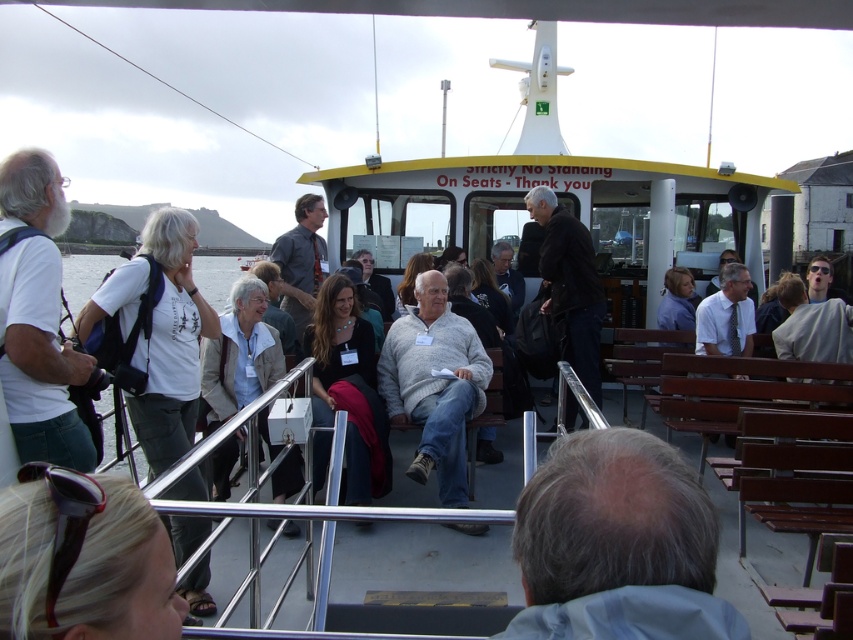
You are a GUI agent. You are given a task and a screenshot of the screen. Output one action in this format:
    pyautogui.click(x=<x>, y=<y>)
    Task: Click on the dark brown leather jacket at center
    This screenshot has width=853, height=640.
    Given the screenshot: What is the action you would take?
    pyautogui.click(x=570, y=285)

Which of these two, gray hair at center or white cotton t-shirt at left, stands taller?

With more height is white cotton t-shirt at left.

You are a GUI agent. You are given a task and a screenshot of the screen. Output one action in this format:
    pyautogui.click(x=<x>, y=<y>)
    Task: Click on the gray hair at center
    The image size is (853, 640).
    Given the screenshot: What is the action you would take?
    pyautogui.click(x=618, y=545)

I want to click on gray hair at center, so click(618, 545).

This screenshot has height=640, width=853. What do you see at coordinates (38, 317) in the screenshot?
I see `white matte shirt at left` at bounding box center [38, 317].

Measure the distance between white matte shirt at left and camera.

The distance of white matte shirt at left from camera is 10.19 feet.

You are a GUI agent. You are given a task and a screenshot of the screen. Output one action in this format:
    pyautogui.click(x=<x>, y=<y>)
    Task: Click on the white matte shirt at left
    The width and height of the screenshot is (853, 640).
    Given the screenshot: What is the action you would take?
    pyautogui.click(x=38, y=317)